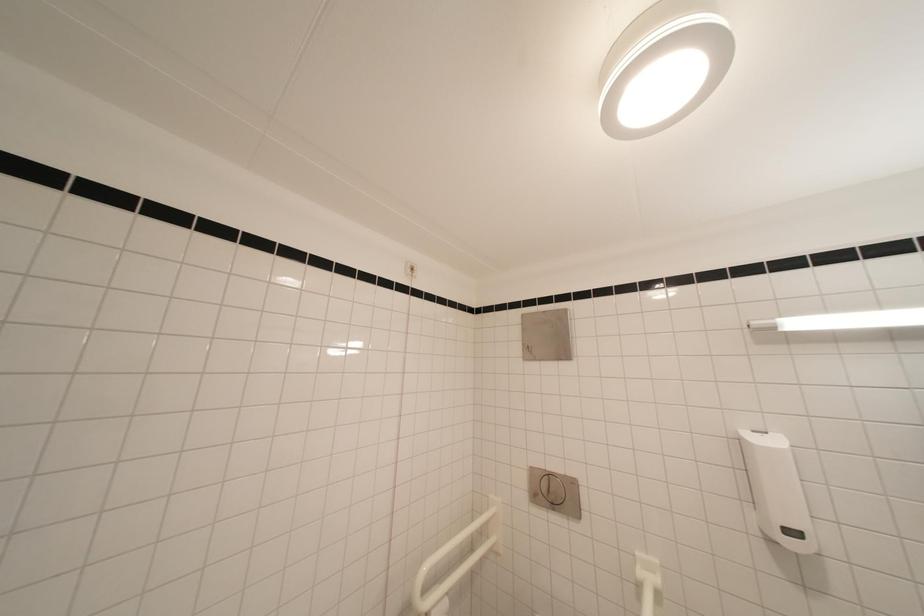
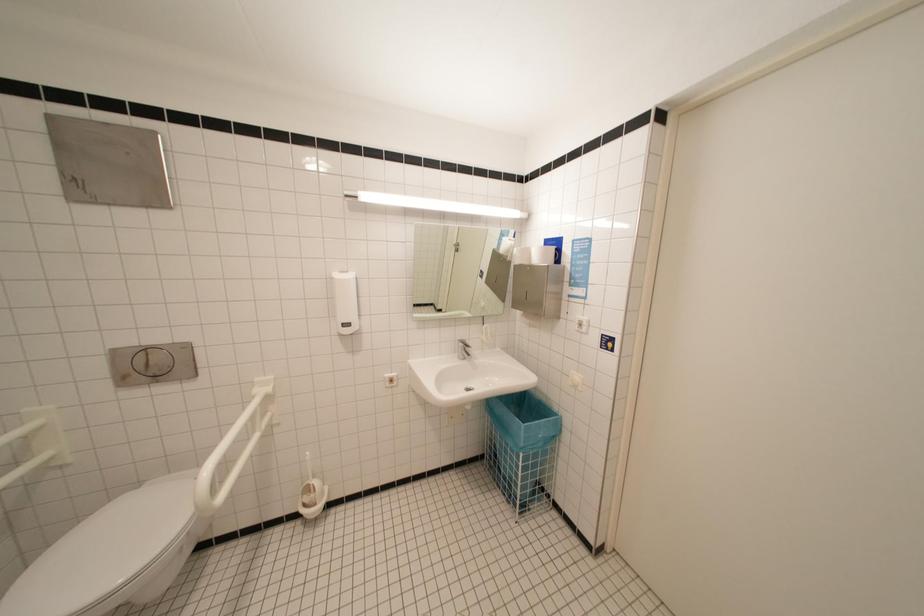
Consider the image. How did the camera likely rotate?

The rotation direction of the camera is right-down.